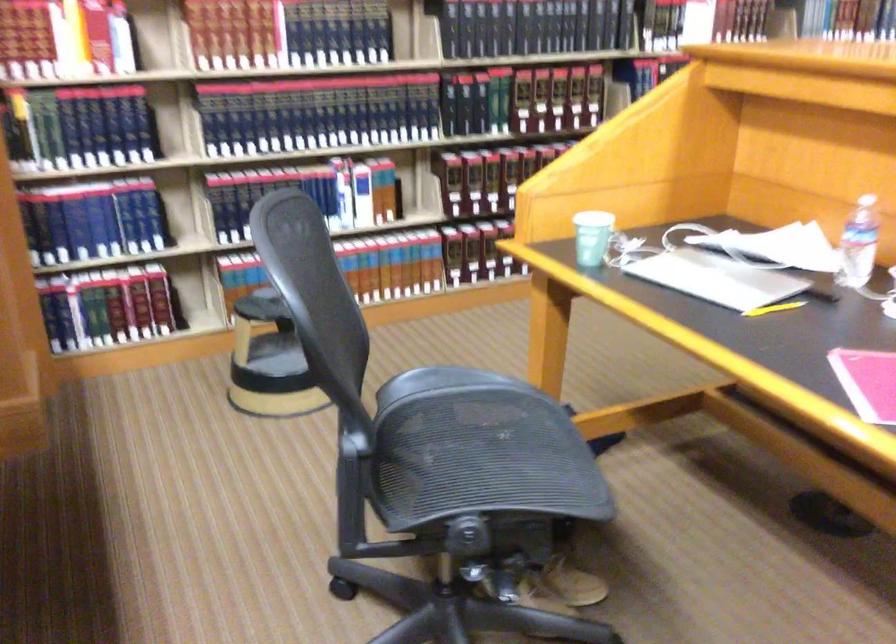
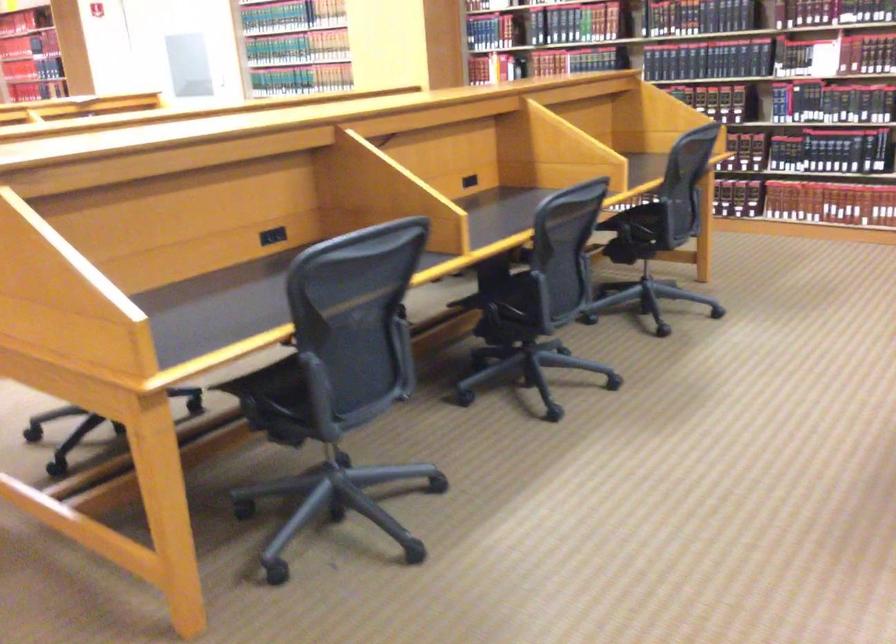
Question: I am providing you with two images of the same scene from different viewpoints. Which of the following objects are not visible in image2?

Choices:
 (A) chair armrest
 (B) plastic water bottle
 (C) creatine container lid
 (D) hardcover book

Answer: (B)